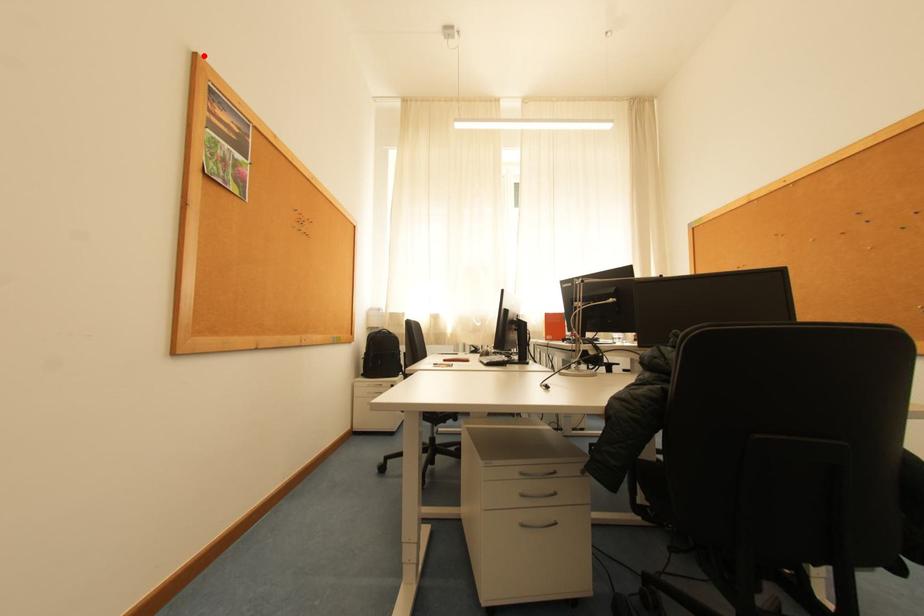
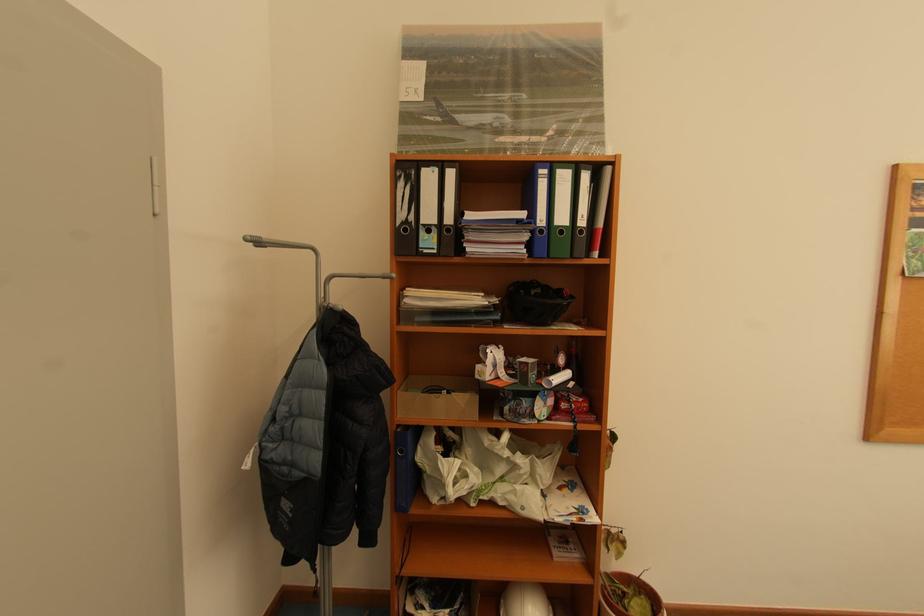
Where in the second image is the point corresponding to the highlighted location from the first image?

(904, 167)